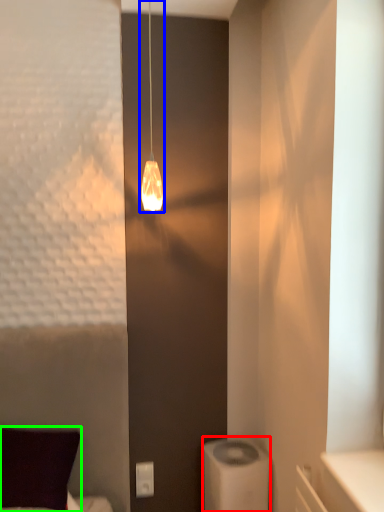
Question: Based on their relative distances, which object is farther from appliance (highlighted by a red box)? Choose from lamp (highlighted by a blue box) and pillow (highlighted by a green box).

Choices:
 (A) lamp
 (B) pillow

Answer: (A)